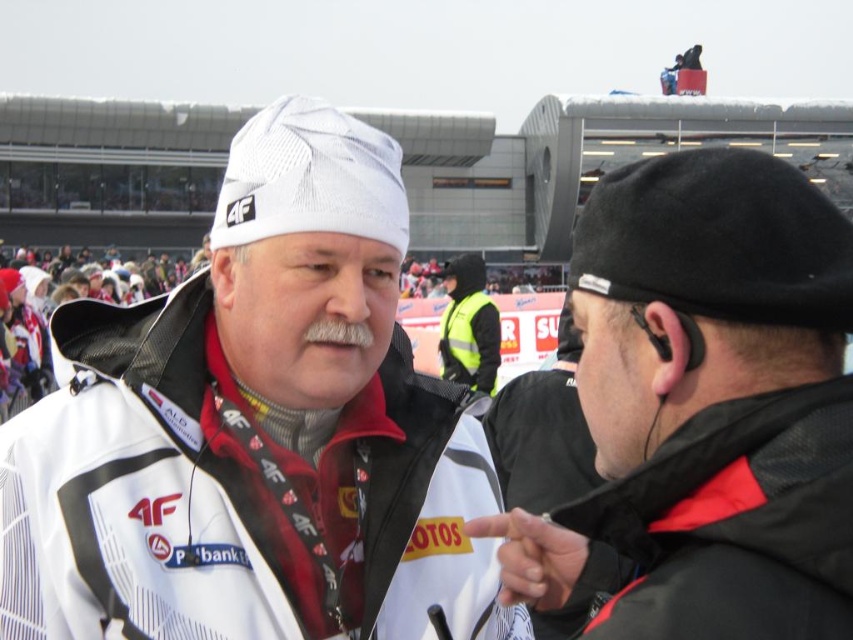
You are a photographer trying to capture a photo of the two men. You notice the white mesh cap at upper center and the black matte jacket at right. Which object should you focus on if you want to capture the larger one in your frame?

The white mesh cap at upper center should be focused on because its width is larger than the black matte jacket at right.

You are a photographer at the event and need to capture a closeup shot of the black matte jacket at right and the black matte earphone at right. Given that your camera has a maximum zoom range of 15 meters, can you get both items in focus in a single shot?

The distance between the black matte jacket at right and the black matte earphone at right is 18.20 meters. Since the camera can only zoom up to 15 meters, it won not be possible to capture both items in focus in a single shot.